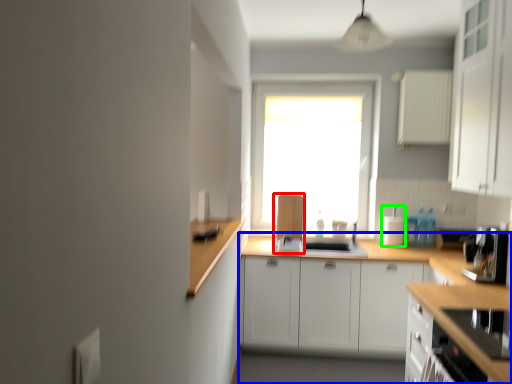
Question: Estimate the real-world distances between objects in this image. Which object is farther from appliance (highlighted by a red box), countertop (highlighted by a blue box) or appliance (highlighted by a green box)?

Choices:
 (A) countertop
 (B) appliance

Answer: (B)